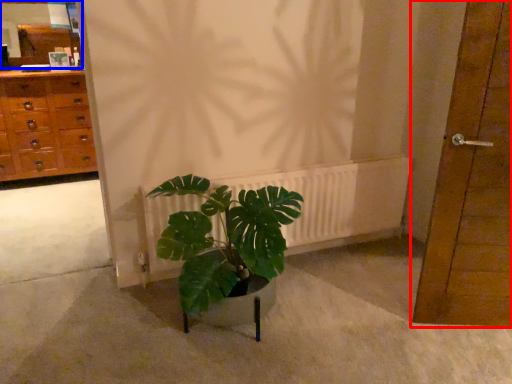
Question: Which object is further to the camera taking this photo, door (highlighted by a red box) or mirror (highlighted by a blue box)?

Choices:
 (A) door
 (B) mirror

Answer: (B)